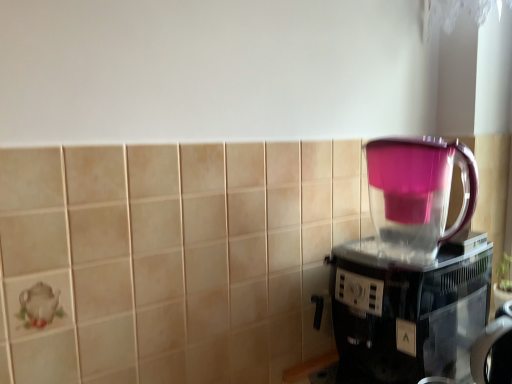
Question: Is pink translucent pitcher at right to the left of transparent plastic coffee maker at right from the viewer's perspective?

Choices:
 (A) yes
 (B) no

Answer: (A)

Question: Considering the relative sizes of pink translucent pitcher at right and transparent plastic coffee maker at right in the image provided, is pink translucent pitcher at right thinner than transparent plastic coffee maker at right?

Choices:
 (A) no
 (B) yes

Answer: (B)

Question: From the image's perspective, is pink translucent pitcher at right above transparent plastic coffee maker at right?

Choices:
 (A) no
 (B) yes

Answer: (B)

Question: Is pink translucent pitcher at right in contact with transparent plastic coffee maker at right?

Choices:
 (A) no
 (B) yes

Answer: (B)

Question: From a real-world perspective, is pink translucent pitcher at right on top of transparent plastic coffee maker at right?

Choices:
 (A) yes
 (B) no

Answer: (A)

Question: Would you say pink translucent pitcher at right is a long distance from transparent plastic coffee maker at right?

Choices:
 (A) no
 (B) yes

Answer: (A)

Question: Is transparent plastic coffee maker at right not near pink translucent pitcher at right?

Choices:
 (A) no
 (B) yes

Answer: (A)

Question: Considering the relative sizes of transparent plastic coffee maker at right and pink translucent pitcher at right in the image provided, is transparent plastic coffee maker at right taller than pink translucent pitcher at right?

Choices:
 (A) no
 (B) yes

Answer: (B)

Question: Considering the relative sizes of transparent plastic coffee maker at right and pink translucent pitcher at right in the image provided, is transparent plastic coffee maker at right thinner than pink translucent pitcher at right?

Choices:
 (A) no
 (B) yes

Answer: (A)

Question: Can you confirm if transparent plastic coffee maker at right is shorter than pink translucent pitcher at right?

Choices:
 (A) yes
 (B) no

Answer: (B)

Question: Is transparent plastic coffee maker at right directly adjacent to pink translucent pitcher at right?

Choices:
 (A) no
 (B) yes

Answer: (B)

Question: Is the depth of transparent plastic coffee maker at right less than that of pink translucent pitcher at right?

Choices:
 (A) no
 (B) yes

Answer: (B)

Question: Considering the relative positions of transparent plastic coffee maker at right and pink translucent pitcher at right in the image provided, is transparent plastic coffee maker at right to the left or to the right of pink translucent pitcher at right?

Choices:
 (A) left
 (B) right

Answer: (B)